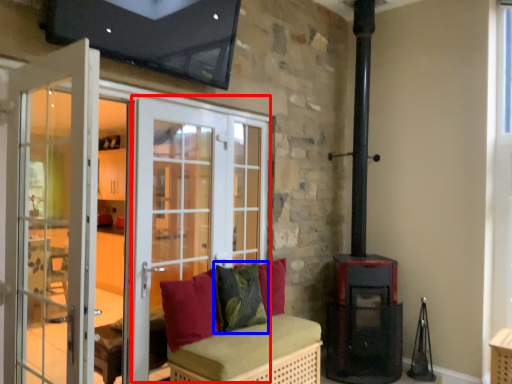
Question: Which object is closer to the camera taking this photo, screen door (highlighted by a red box) or pillow (highlighted by a blue box)?

Choices:
 (A) screen door
 (B) pillow

Answer: (A)